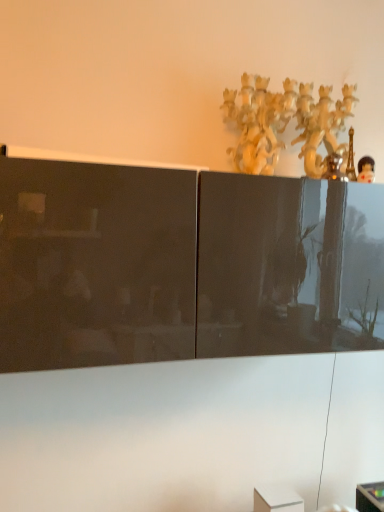
This screenshot has width=384, height=512. Describe the element at coordinates (370, 497) in the screenshot. I see `matte black cabinet at upper center` at that location.

Measure the distance between point (265, 494) and camera.

Point (265, 494) is 3.84 feet from camera.

Identify the location of white glossy cabinet at upper center. This screenshot has height=512, width=384. (277, 498).

Find the location of `matte black cabinet at upper center`. matte black cabinet at upper center is located at coordinates (370, 497).

From the image's perspective, relative to matte black cabinet at upper center, is white glossy cabinet at upper center above or below?

white glossy cabinet at upper center is situated higher than matte black cabinet at upper center in the image.

From a real-world perspective, who is located higher, white glossy cabinet at upper center or matte black cabinet at upper center?

white glossy cabinet at upper center, from a real-world perspective.

Would you say white glossy cabinet at upper center is to the left or to the right of matte black cabinet at upper center in the picture?

From the image, it's evident that white glossy cabinet at upper center is to the left of matte black cabinet at upper center.

Is polished plastic figurine at upper right in contact with white glossy cabinet at upper center?

polished plastic figurine at upper right and white glossy cabinet at upper center are not in contact.

From a real-world perspective, is polished plastic figurine at upper right over white glossy cabinet at upper center?

Correct, in the physical world, polished plastic figurine at upper right is higher than white glossy cabinet at upper center.

Is polished plastic figurine at upper right taller or shorter than white glossy cabinet at upper center?

polished plastic figurine at upper right is shorter than white glossy cabinet at upper center.

Is polished plastic figurine at upper right inside or outside of white glossy cabinet at upper center?

polished plastic figurine at upper right is outside white glossy cabinet at upper center.

Is matte black cabinet at upper center shorter than white glossy cabinet at upper center?

Incorrect, the height of matte black cabinet at upper center does not fall short of that of white glossy cabinet at upper center.

Is matte black cabinet at upper center spatially inside white glossy cabinet at upper center, or outside of it?

matte black cabinet at upper center cannot be found inside white glossy cabinet at upper center.

Considering the positions of objects matte black cabinet at upper center and white glossy cabinet at upper center in the image provided, who is more to the right, matte black cabinet at upper center or white glossy cabinet at upper center?

From the viewer's perspective, matte black cabinet at upper center appears more on the right side.

From the image's perspective, which one is positioned higher, matte black cabinet at upper center or white glossy cabinet at upper center?

white glossy cabinet at upper center is shown above in the image.

Which point is more distant from viewer, (x=375, y=486) or (x=371, y=176)?

The point (x=375, y=486) is farther from the camera.

Who is more distant, matte black cabinet at upper center or polished plastic figurine at upper right?

matte black cabinet at upper center is further away from the camera.

Where is `toy positioned vertically above the matte black cabinet at upper center (from a real-world perspective)`? toy positioned vertically above the matte black cabinet at upper center (from a real-world perspective) is located at coordinates coord(366,170).

Is polished plastic figurine at upper right at the back of white glossy cabinet at upper center?

white glossy cabinet at upper center does not have its back to polished plastic figurine at upper right.

Does white glossy cabinet at upper center touch polished plastic figurine at upper right?

No, white glossy cabinet at upper center is not next to polished plastic figurine at upper right.

Find the location of a particular element. Image resolution: width=384 pixels, height=512 pixels. cabinetry below the polished plastic figurine at upper right (from the image's perspective) is located at coordinates (277, 498).

Which object is positioned more to the left, white glossy cabinet at upper center or polished plastic figurine at upper right?

white glossy cabinet at upper center.

Who is smaller, polished plastic figurine at upper right or matte black cabinet at upper center?

With smaller size is polished plastic figurine at upper right.

Which object is closer to the camera, polished plastic figurine at upper right or matte black cabinet at upper center?

polished plastic figurine at upper right.

You are a GUI agent. You are given a task and a screenshot of the screen. Output one action in this format:
    pyautogui.click(x=<x>, y=<y>)
    Task: Click on the furniture behind the polished plastic figurine at upper right
    This screenshot has width=384, height=512.
    Given the screenshot: What is the action you would take?
    pyautogui.click(x=370, y=497)

The image size is (384, 512). In order to click on furniture located on the right of white glossy cabinet at upper center in this screenshot , I will do `click(370, 497)`.

You are a GUI agent. You are given a task and a screenshot of the screen. Output one action in this format:
    pyautogui.click(x=<x>, y=<y>)
    Task: Click on the cabinetry that appears below the polished plastic figurine at upper right (from a real-world perspective)
    
    Given the screenshot: What is the action you would take?
    pyautogui.click(x=277, y=498)

From the image, which object appears to be farther from white glossy cabinet at upper center, matte black cabinet at upper center or polished plastic figurine at upper right?

polished plastic figurine at upper right is further to white glossy cabinet at upper center.

Based on the photo, from the image, which object appears to be nearer to matte black cabinet at upper center, white glossy cabinet at upper center or polished plastic figurine at upper right?

The object closer to matte black cabinet at upper center is white glossy cabinet at upper center.

Considering their positions, is polished plastic figurine at upper right positioned closer to white glossy cabinet at upper center than matte black cabinet at upper center?

matte black cabinet at upper center is closer to white glossy cabinet at upper center.

From the image, which object appears to be nearer to polished plastic figurine at upper right, white glossy cabinet at upper center or matte black cabinet at upper center?

white glossy cabinet at upper center.

When comparing their distances from polished plastic figurine at upper right, does matte black cabinet at upper center or white glossy cabinet at upper center seem closer?

white glossy cabinet at upper center.

Estimate the real-world distances between objects in this image. Which object is further from matte black cabinet at upper center, polished plastic figurine at upper right or white glossy cabinet at upper center?

polished plastic figurine at upper right is further to matte black cabinet at upper center.

At what (x,y) coordinates should I click in order to perform the action: click on cabinetry between polished plastic figurine at upper right and matte black cabinet at upper center in the up-down direction. Please return your answer as a coordinate pair (x, y). Image resolution: width=384 pixels, height=512 pixels. Looking at the image, I should click on (277, 498).